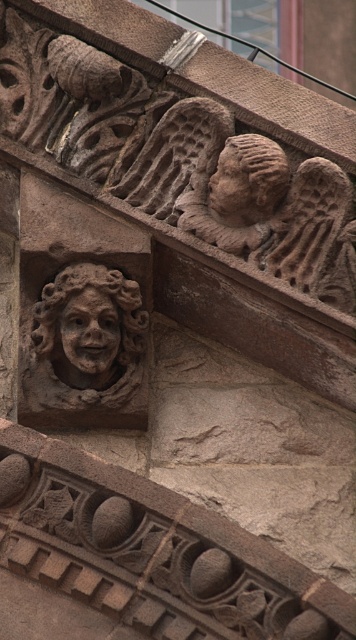
This screenshot has height=640, width=356. Describe the element at coordinates (248, 179) in the screenshot. I see `brown stone head at upper center` at that location.

Between brown stone head at upper center and matte stone face at upper center, which one appears on the left side from the viewer's perspective?

matte stone face at upper center is more to the left.

Does point (248, 154) lie behind point (213, 189)?

No, (248, 154) is in front of (213, 189).

Locate an element on the screen. brown stone head at upper center is located at coordinates (248, 179).

Between point (93, 349) and point (242, 212), which one is positioned behind?

The point (242, 212) is more distant.

Is point (74, 300) behind point (228, 145)?

That is False.

Which is behind, point (91, 316) or point (247, 209)?

The point (247, 209) is behind.

Locate an element on the screen. The width and height of the screenshot is (356, 640). matte stone face at center is located at coordinates (90, 332).

Does brown stone face at center have a greater height compared to brown stone head at upper center?

Correct, brown stone face at center is much taller as brown stone head at upper center.

Which is more to the left, brown stone face at center or brown stone head at upper center?

brown stone face at center is more to the left.

This screenshot has width=356, height=640. In order to click on brown stone face at center in this screenshot , I will do `click(85, 340)`.